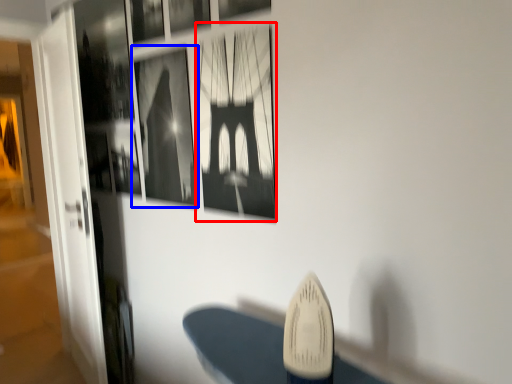
Question: Which object appears closest to the camera in this image, picture frame (highlighted by a red box) or picture frame (highlighted by a blue box)?

Choices:
 (A) picture frame
 (B) picture frame

Answer: (A)